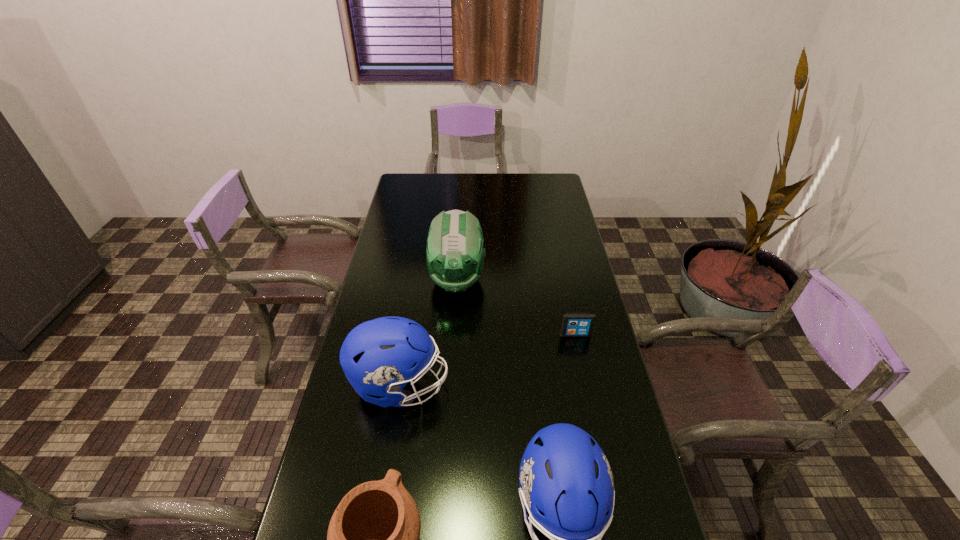
You are a GUI agent. You are given a task and a screenshot of the screen. Output one action in this format:
    pyautogui.click(x=<x>, y=<y>)
    Task: Click on the farthest football helmet
    The image size is (960, 540).
    Given the screenshot: What is the action you would take?
    pyautogui.click(x=455, y=255)

Image resolution: width=960 pixels, height=540 pixels. Identify the location of the second nearest football helmet. (x=379, y=357).

Identify the location of the shortest object. (574, 324).

The image size is (960, 540). I want to click on iPod, so click(x=574, y=324).

Find the location of a particular element. The width and height of the screenshot is (960, 540). vacant space located on the visor of the farthest object is located at coordinates (452, 361).

Where is `vacant space located 0.290m on the front-facing side of the third farthest object`? vacant space located 0.290m on the front-facing side of the third farthest object is located at coordinates (550, 385).

What are the coordinates of `free space located 0.200m on the front screen of the fourth nearest object` in the screenshot? It's located at (588, 390).

Identify the location of object present at the left edge. (379, 357).

Where is `object that is at the right edge`? The height and width of the screenshot is (540, 960). object that is at the right edge is located at coordinates (574, 324).

Image resolution: width=960 pixels, height=540 pixels. In the image, there is a desktop. Identify the location of vacant space at the far edge. (517, 177).